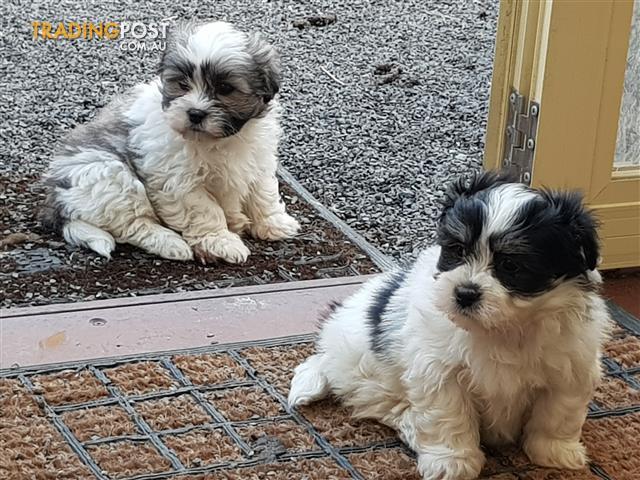
Where is `rocky flooring`? The image size is (640, 480). rocky flooring is located at coordinates (339, 89).